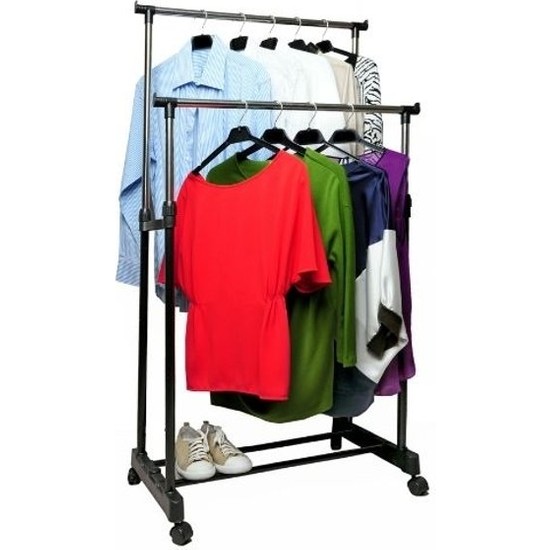
Locate an element on the screen. hanger is located at coordinates (242, 141), (267, 133), (316, 136), (366, 136), (342, 52), (301, 49), (272, 37), (236, 40), (202, 41).